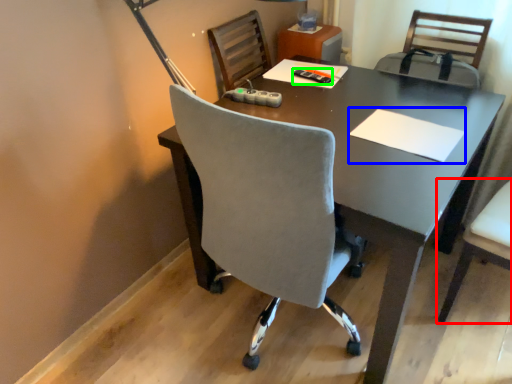
Question: Which object is the farthest from chair (highlighted by a red box)? Choose among these: notepad (highlighted by a blue box) or stationery (highlighted by a green box).

Choices:
 (A) notepad
 (B) stationery

Answer: (B)